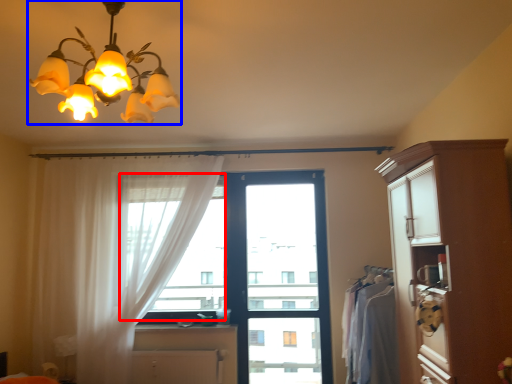
Question: Among these objects, which one is nearest to the camera, window screen (highlighted by a red box) or lamp (highlighted by a blue box)?

Choices:
 (A) window screen
 (B) lamp

Answer: (B)